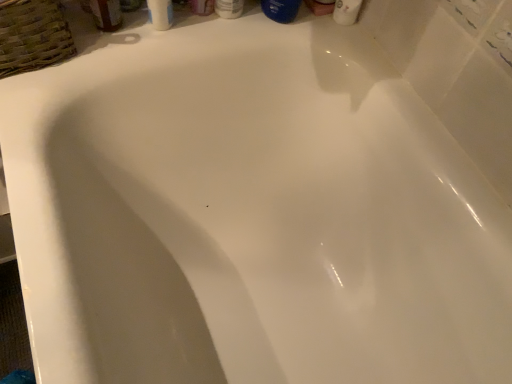
The width and height of the screenshot is (512, 384). What are the coordinates of `vacant space in front of matte plastic bottle at upper center, the first toiletry when ordered from left to right` in the screenshot? It's located at (170, 36).